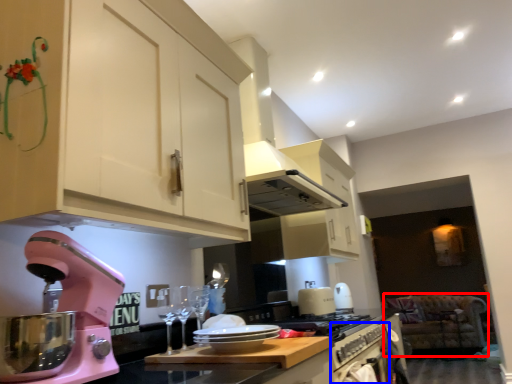
Question: Which object is further to the camera taking this photo, sit (highlighted by a red box) or oven (highlighted by a blue box)?

Choices:
 (A) sit
 (B) oven

Answer: (A)